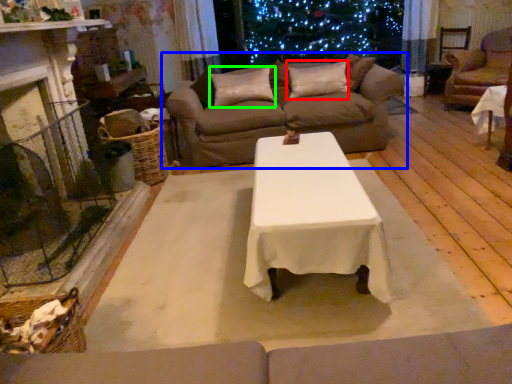
Question: Estimate the real-world distances between objects in this image. Which object is farther from pillow (highlighted by a red box), studio couch (highlighted by a blue box) or pillow (highlighted by a green box)?

Choices:
 (A) studio couch
 (B) pillow

Answer: (A)